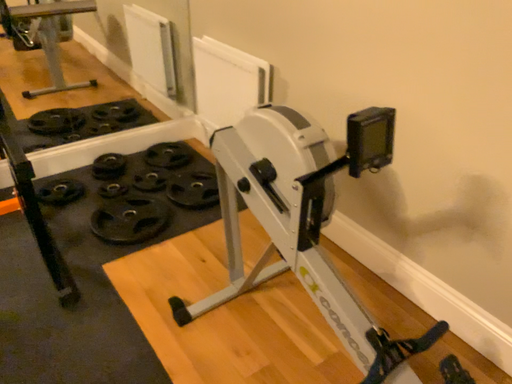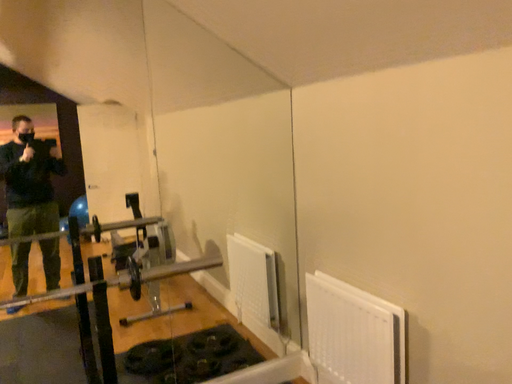
Question: How did the camera likely rotate when shooting the video?

Choices:
 (A) rotated downward
 (B) rotated upward

Answer: (B)